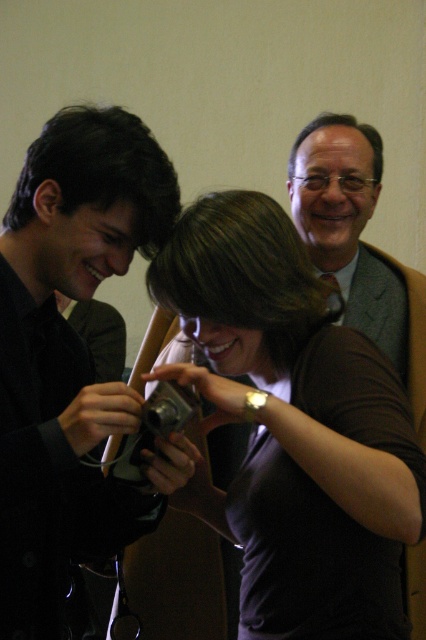
Is matte black camera at center below matte black camera at left?

Correct, matte black camera at center is located below matte black camera at left.

Does matte black camera at center have a larger size compared to matte black camera at left?

Yes.

Does point (365, 468) come in front of point (94, 520)?

Yes.

Where is `matte black camera at center`? matte black camera at center is located at coordinates (293, 426).